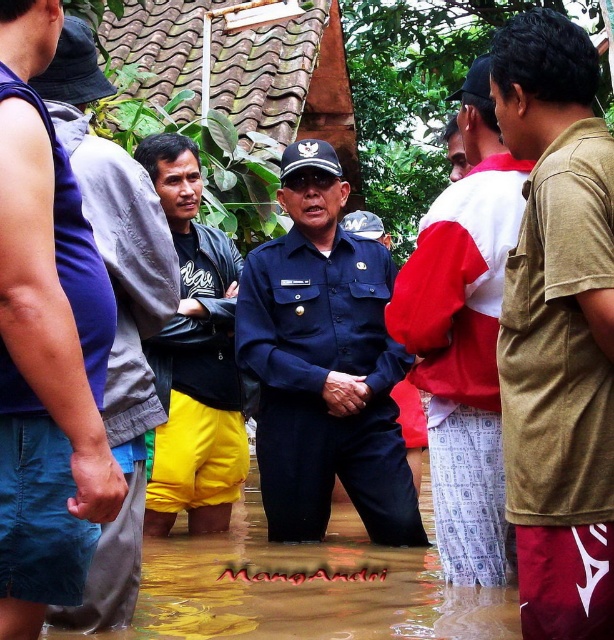
You are a photographer trying to capture a clear photo of the red and white shirt at center and the brown cotton shirt at right. Which shirt should you focus on first to ensure it appears sharp in the foreground?

The red and white shirt at center should be focused on first because it is in the foreground, closer to the camera than the brown cotton shirt at right which is positioned further back.